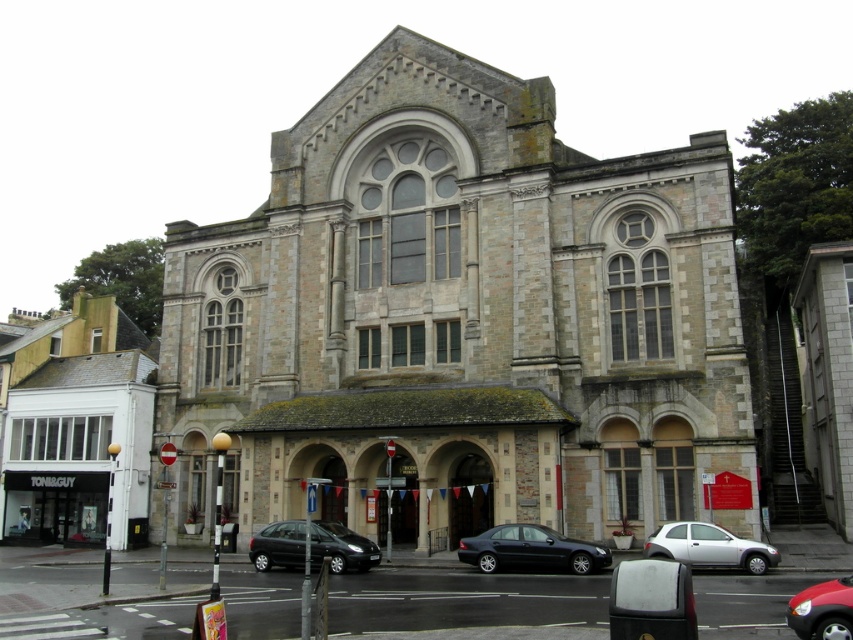
You are standing at the entrance of the historic building and notice two points marked on the ground. The first point is at coordinates point (x=753, y=556) and the second is at point (x=851, y=637). If you were to walk from the first point to the second, would you be moving towards the building or away from it?

Since point (x=753, y=556) is behind point (x=851, y=637), moving from the first to the second point would mean moving away from the building.

You are a delivery person who needs to park your shiny black hatchback at center in a parking spot located at coordinates 0.855, 0.366. Can you confirm if the vehicle is already parked correctly?

The shiny black hatchback at center is already positioned at point (311, 547), so it is correctly parked in the designated parking spot.